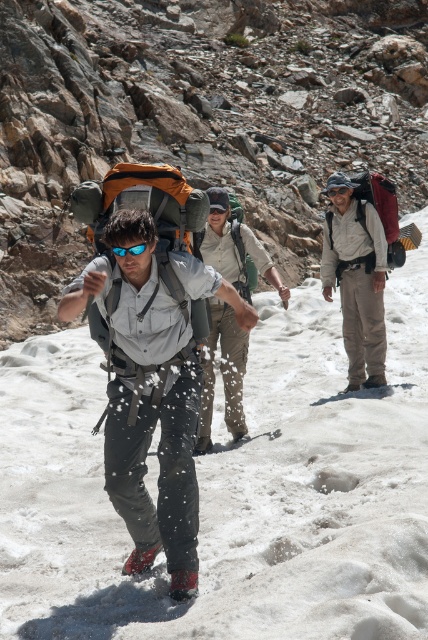
You are a photographer trying to capture the group in the snowy landscape. You notice two items on the central hiker. Which item is positioned to the right of the other? The matte gray shirt at center and the matte gray jacket at center.

The matte gray jacket at center is positioned to the right of the matte gray shirt at center.

You are a hiker planning to take a photo of the matte gray jacket at center and the rough stone hillside at upper left. Which object should you focus on first to ensure both are in sharp focus?

You should focus on the rough stone hillside at upper left first because it is closer to you than the matte gray jacket at center, ensuring both will be in focus when using a camera with a fixed focal plane.